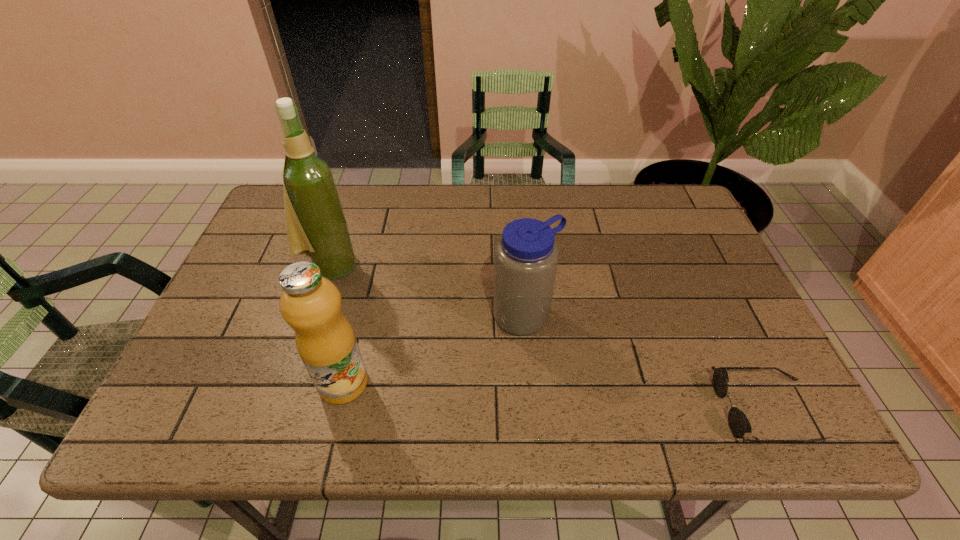
This screenshot has height=540, width=960. I want to click on free space located on the front-facing side of the wine bottle, so click(x=447, y=334).

Identify the location of blank space located 0.360m on the front-facing side of the wine bottle. The height and width of the screenshot is (540, 960). (461, 342).

Where is `vacant space located 0.340m on the front-facing side of the wine bottle`? Image resolution: width=960 pixels, height=540 pixels. vacant space located 0.340m on the front-facing side of the wine bottle is located at coordinates (454, 338).

Find the location of a particular element. fruit juice situated at the near edge is located at coordinates (311, 304).

I want to click on sunglasses that is at the near edge, so click(x=739, y=424).

Where is `object that is at the right edge`? object that is at the right edge is located at coordinates (739, 424).

Image resolution: width=960 pixels, height=540 pixels. I want to click on object that is positioned at the near right corner, so click(739, 424).

Find the location of a particular element. The width and height of the screenshot is (960, 540). vacant space at the far edge of the desktop is located at coordinates (398, 231).

Find the location of a particular element. free point at the near edge is located at coordinates click(x=529, y=369).

The image size is (960, 540). I want to click on free spot at the left edge of the desktop, so click(x=256, y=309).